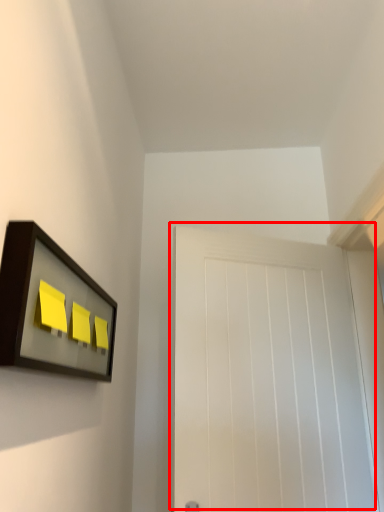
Question: Considering the relative positions of door (annotated by the red box) and picture frame in the image provided, where is door (annotated by the red box) located with respect to the staircase?

Choices:
 (A) right
 (B) left

Answer: (A)